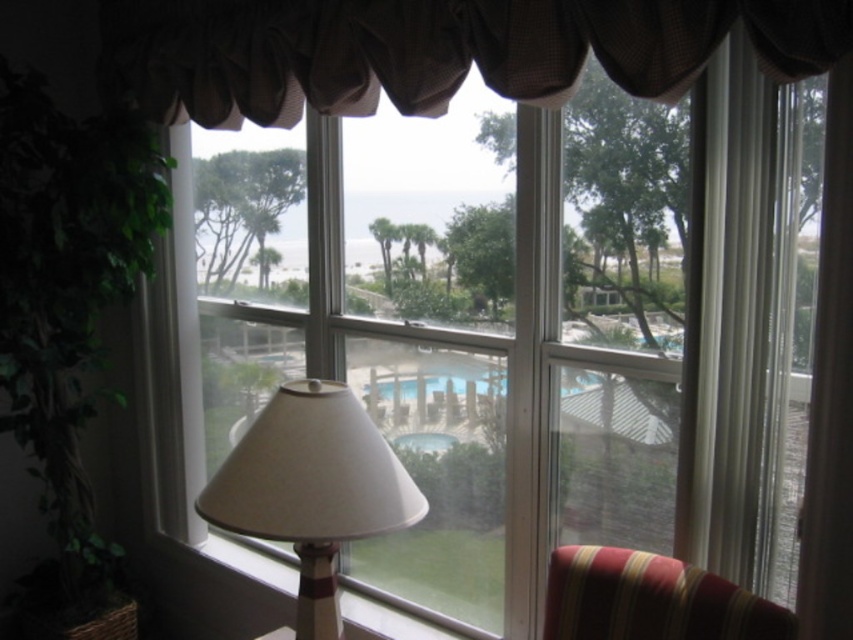
Who is shorter, striped fabric armchair at lower right or transparent glass pool at center?

transparent glass pool at center

Is point (604, 572) farther from viewer compared to point (564, 384)?

That is False.

Describe the element at coordinates (651, 600) in the screenshot. The width and height of the screenshot is (853, 640). I see `striped fabric armchair at lower right` at that location.

Find the location of `striped fabric armchair at lower right`. striped fabric armchair at lower right is located at coordinates (651, 600).

Does brown textured valance at upper center appear over striped fabric armchair at lower right?

Yes, brown textured valance at upper center is above striped fabric armchair at lower right.

Does brown textured valance at upper center have a lesser height compared to striped fabric armchair at lower right?

In fact, brown textured valance at upper center may be taller than striped fabric armchair at lower right.

Is point (627, 90) farther from camera compared to point (700, 608)?

Yes.

The height and width of the screenshot is (640, 853). I want to click on brown textured valance at upper center, so click(x=433, y=51).

Which is behind, point (621, 83) or point (267, 456)?

The point (267, 456) is behind.

The image size is (853, 640). In order to click on brown textured valance at upper center in this screenshot , I will do `click(433, 51)`.

You are a GUI agent. You are given a task and a screenshot of the screen. Output one action in this format:
    pyautogui.click(x=<x>, y=<y>)
    Task: Click on the brown textured valance at upper center
    This screenshot has width=853, height=640.
    Given the screenshot: What is the action you would take?
    pyautogui.click(x=433, y=51)